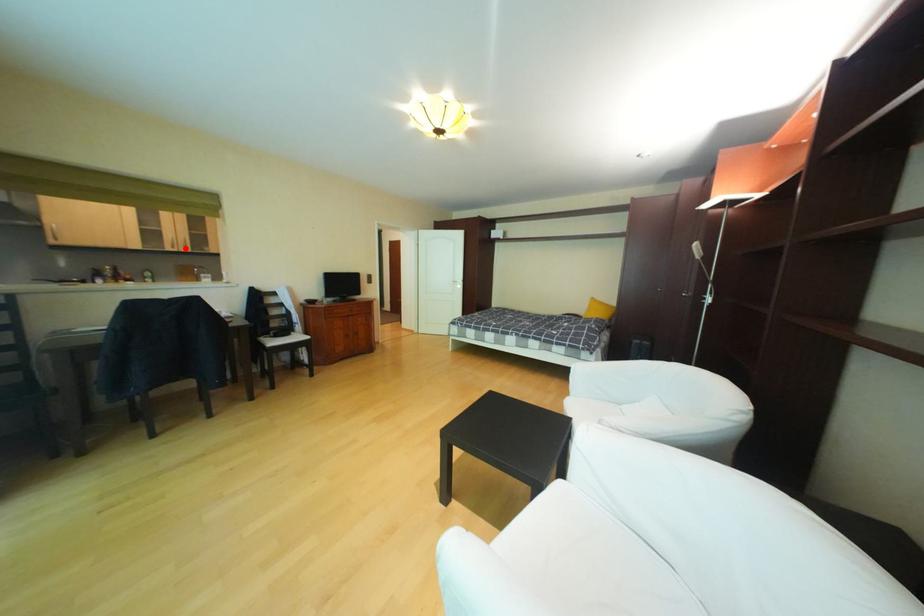
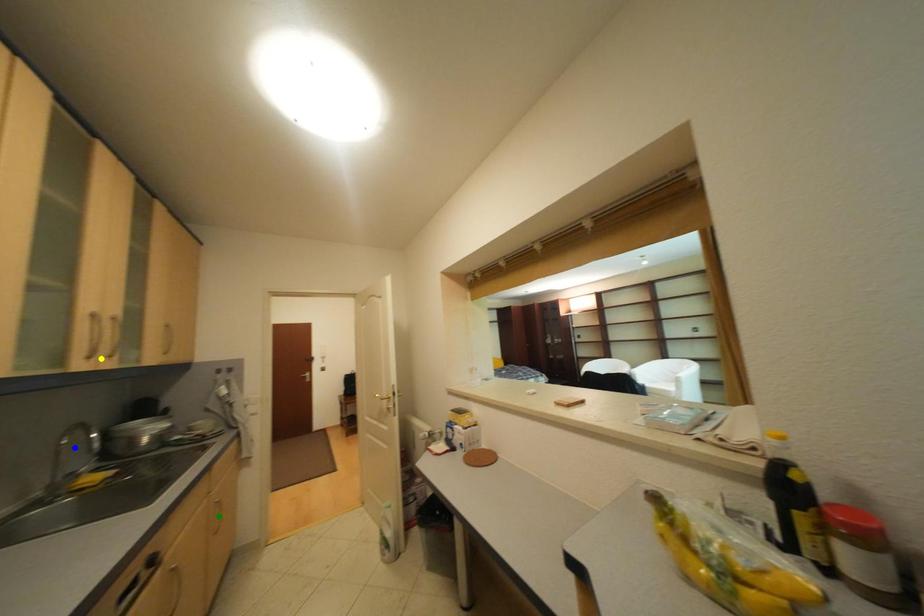
Question: I am providing you with two images of the same scene from different viewpoints. A red point is marked on the first image. You are given multiple points on the second image. Which point in image 2 is actually the same real-world point as the red point in image 1?

Choices:
 (A) yellow point
 (B) green point
 (C) blue point

Answer: (A)